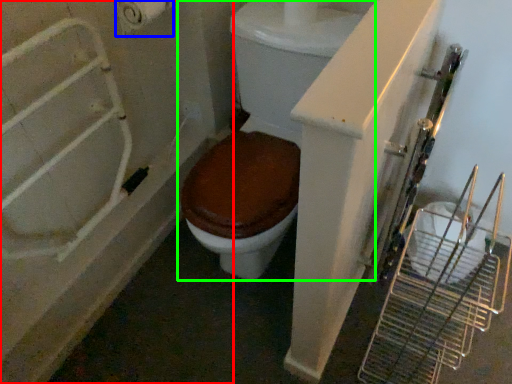
Question: Which object is positioned closest to bath (highlighted by a red box)? Select from toilet paper (highlighted by a blue box) and toilet (highlighted by a green box).

Choices:
 (A) toilet paper
 (B) toilet

Answer: (B)